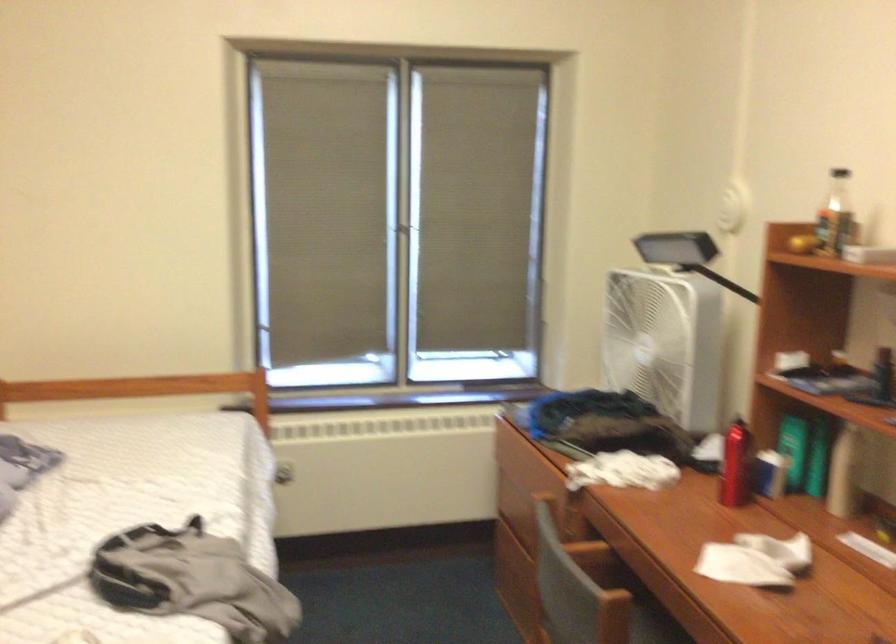
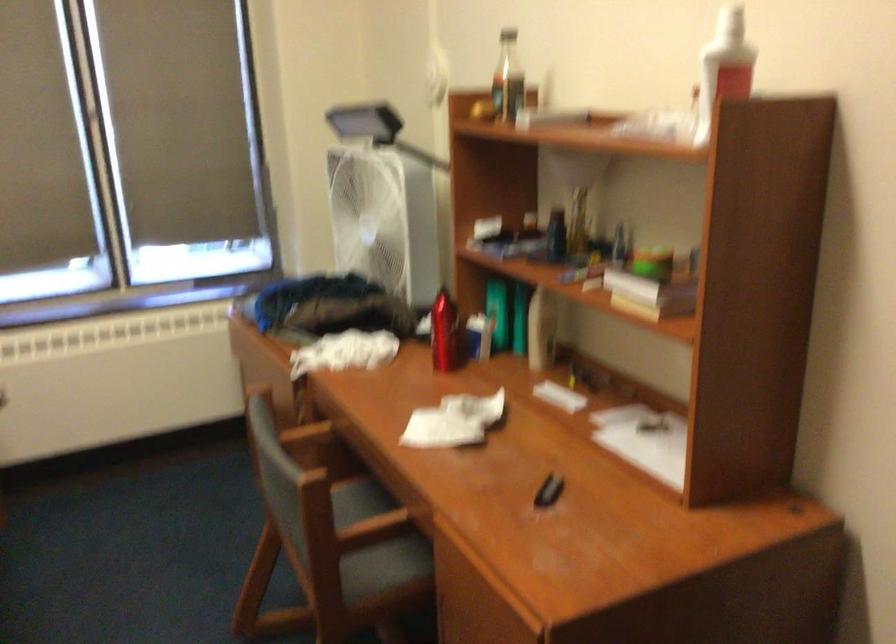
Where in the second image is the point corresponding to [586,553] from the first image?

(306, 435)